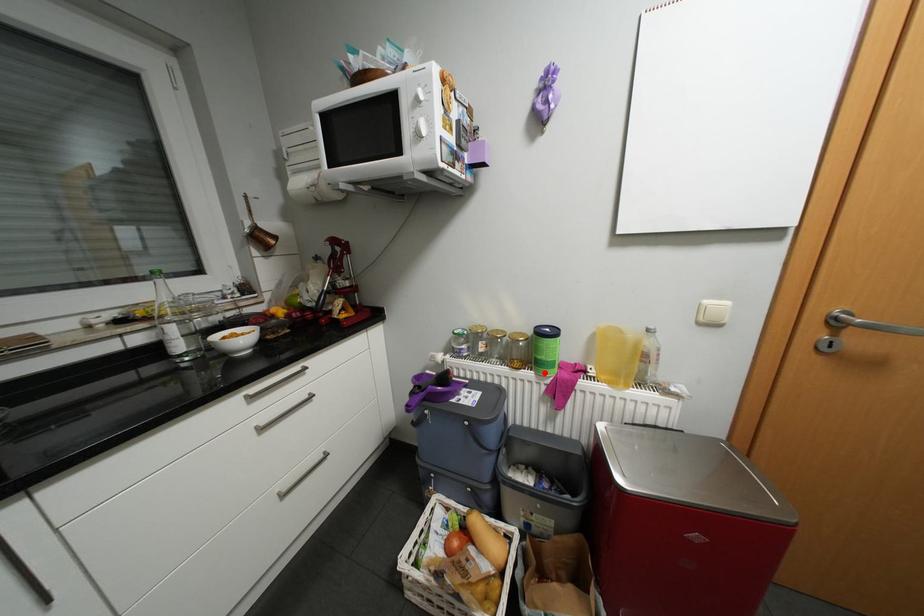
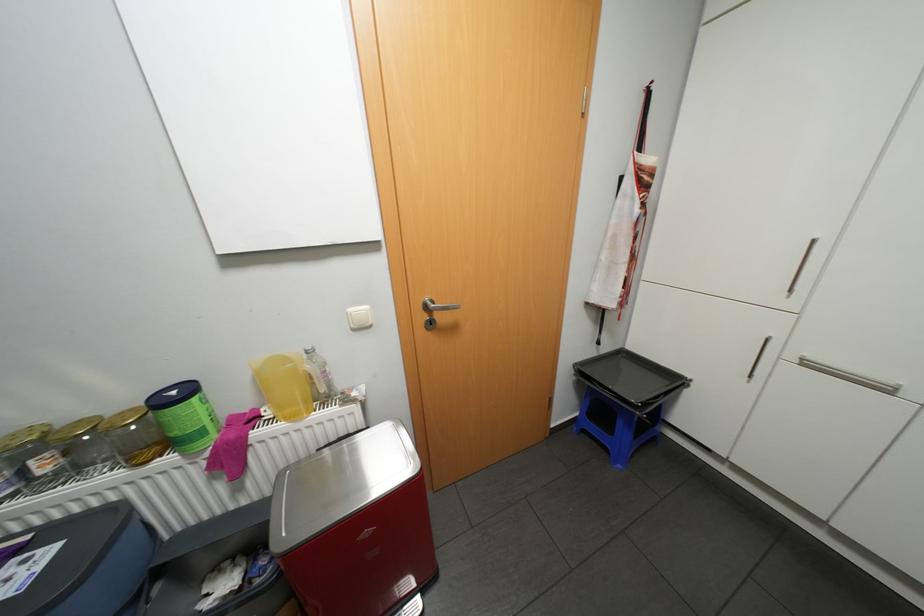
Find the pixel in the second image that matches the highlighted location in the first image.

(190, 453)